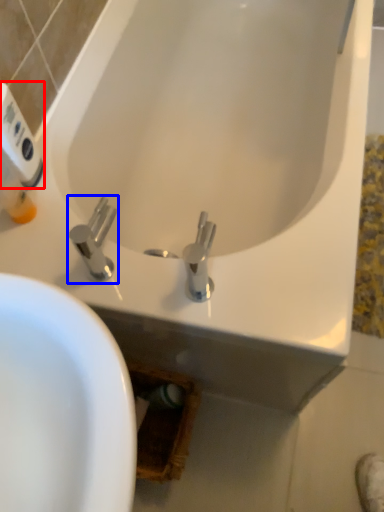
Question: Among these objects, which one is farthest to the camera, hand dryer (highlighted by a red box) or tap (highlighted by a blue box)?

Choices:
 (A) hand dryer
 (B) tap

Answer: (A)